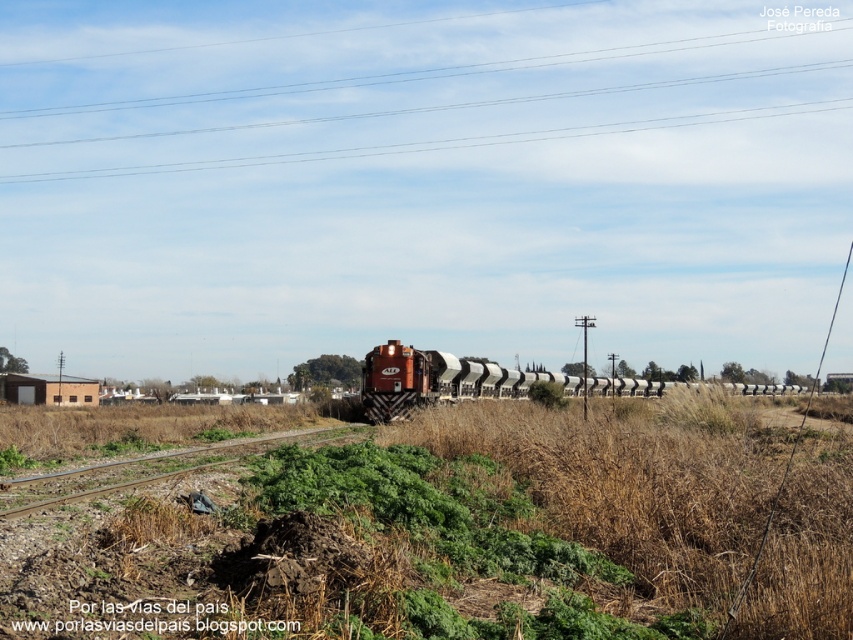
Can you confirm if matte orange train at center is wider than brown gravel track at lower center?

Yes, matte orange train at center is wider than brown gravel track at lower center.

Does matte orange train at center appear on the left side of brown gravel track at lower center?

No, matte orange train at center is not to the left of brown gravel track at lower center.

Where is `matte orange train at center`? The image size is (853, 640). matte orange train at center is located at coordinates (466, 381).

Is metallic wires at upper center further to the viewer compared to matte orange train at center?

Yes.

Between metallic wires at upper center and matte orange train at center, which one has less height?

matte orange train at center

Identify the location of metallic wires at upper center. This screenshot has height=640, width=853. (432, 72).

Is point (317, 88) less distant than point (152, 458)?

No, it is behind (152, 458).

Is point (724, 45) farther from camera compared to point (13, 483)?

Yes, it is behind point (13, 483).

Locate an element on the screen. metallic wires at upper center is located at coordinates (432, 72).